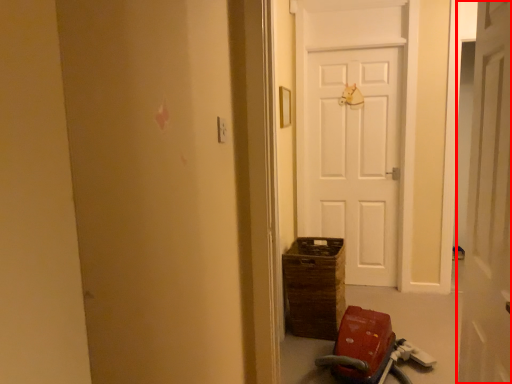
Question: From the image, what is the correct spatial relationship of door (annotated by the red box) in relation to baby carriage?

Choices:
 (A) right
 (B) left

Answer: (A)